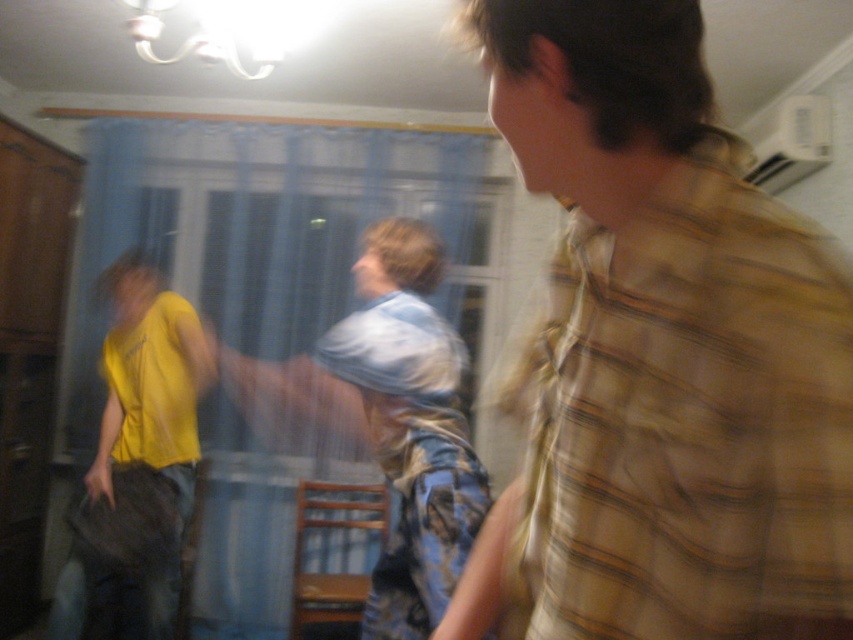
Based on the scene description, which object is smaller in size between the blue sheer curtain at center and the yellow matte shirt at left?

The blue sheer curtain at center is smaller than the yellow matte shirt at left according to the description.

In the image, there are two people wearing yellow shirts. One is labeled as the yellow plaid shirt at right and the other as the yellow matte shirt at left. From the observer perspective, which one is positioned more to the right side of the image?

The yellow plaid shirt at right is positioned more to the right side of the image compared to the yellow matte shirt at left.